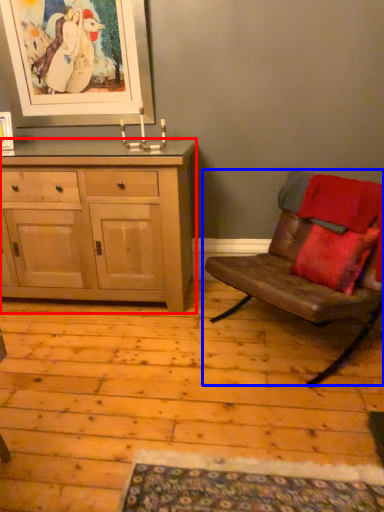
Question: Which of the following is the closest to the observer, cabinetry (highlighted by a red box) or chair (highlighted by a blue box)?

Choices:
 (A) cabinetry
 (B) chair

Answer: (B)